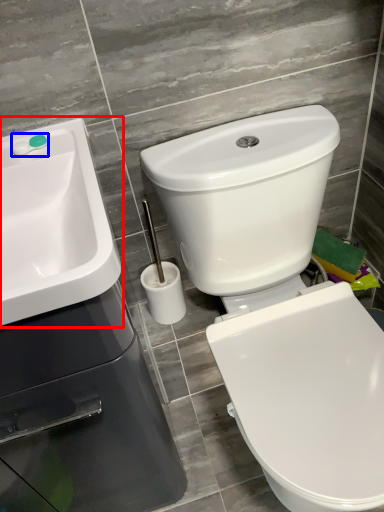
Question: Which point is closer to the camera, sink (highlighted by a red box) or plumbing fixture (highlighted by a blue box)?

Choices:
 (A) sink
 (B) plumbing fixture

Answer: (A)